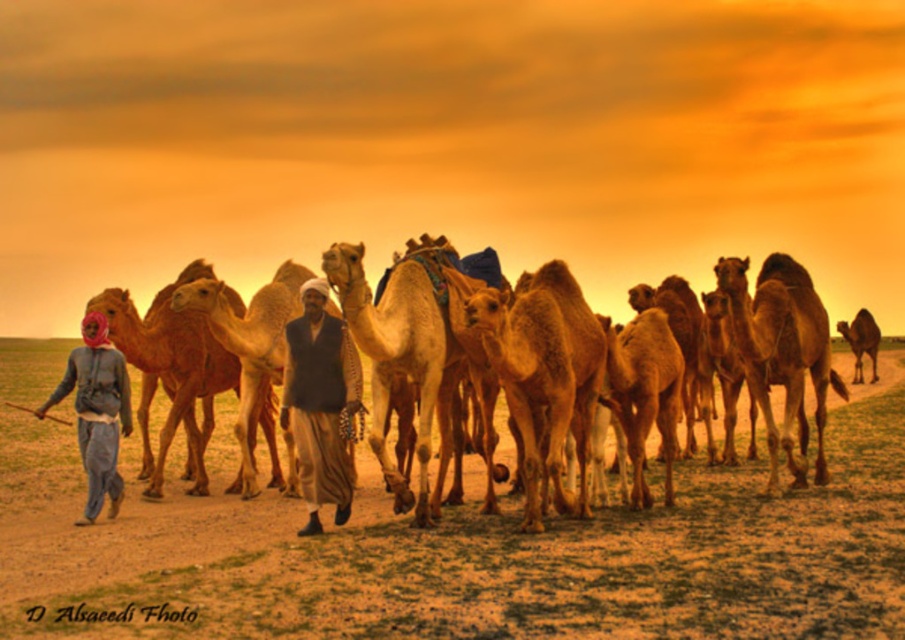
You are a traveler in the desert and see a fuzzy beige camel at center and a denim jacket at left. Which object is shorter?

The fuzzy beige camel at center is not as tall as the denim jacket at left, so the camel is shorter.

You are a traveler navigating a desert and need to cross the brown textured sand at center. Based on the coordinates provided, is the sand centrally positioned in the image?

The brown textured sand at center is located at point (470, 556), which indicates it is centrally positioned in the image.